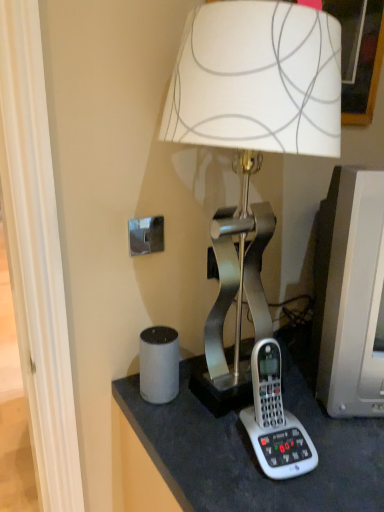
Question: Can you confirm if white plastic corded phone at lower right is bigger than matte gray monitor at right?

Choices:
 (A) yes
 (B) no

Answer: (B)

Question: Is white plastic corded phone at lower right completely or partially outside of matte gray monitor at right?

Choices:
 (A) yes
 (B) no

Answer: (A)

Question: Is white plastic corded phone at lower right next to matte gray monitor at right and touching it?

Choices:
 (A) no
 (B) yes

Answer: (A)

Question: Does white plastic corded phone at lower right appear on the left side of matte gray monitor at right?

Choices:
 (A) yes
 (B) no

Answer: (A)

Question: Is white plastic corded phone at lower right thinner than matte gray monitor at right?

Choices:
 (A) yes
 (B) no

Answer: (A)

Question: From the image's perspective, is matte gray monitor at right above or below metallic silver lamp at center?

Choices:
 (A) below
 (B) above

Answer: (A)

Question: Would you say matte gray monitor at right is inside or outside metallic silver lamp at center?

Choices:
 (A) outside
 (B) inside

Answer: (A)

Question: Is matte gray monitor at right in front of or behind metallic silver lamp at center in the image?

Choices:
 (A) behind
 (B) front

Answer: (A)

Question: Based on their sizes in the image, would you say matte gray monitor at right is bigger or smaller than metallic silver lamp at center?

Choices:
 (A) small
 (B) big

Answer: (A)

Question: In the image, is metallic silver lamp at center positioned in front of or behind white plastic corded phone at lower right?

Choices:
 (A) behind
 (B) front

Answer: (B)

Question: In terms of width, does metallic silver lamp at center look wider or thinner when compared to white plastic corded phone at lower right?

Choices:
 (A) thin
 (B) wide

Answer: (B)

Question: Is metallic silver lamp at center inside or outside of white plastic corded phone at lower right?

Choices:
 (A) inside
 (B) outside

Answer: (B)

Question: From a real-world perspective, is metallic silver lamp at center physically located above or below white plastic corded phone at lower right?

Choices:
 (A) below
 (B) above

Answer: (B)

Question: Relative to white plastic corded phone at lower right, is matte gray monitor at right in front or behind?

Choices:
 (A) behind
 (B) front

Answer: (A)

Question: Is matte gray monitor at right bigger or smaller than white plastic corded phone at lower right?

Choices:
 (A) big
 (B) small

Answer: (A)